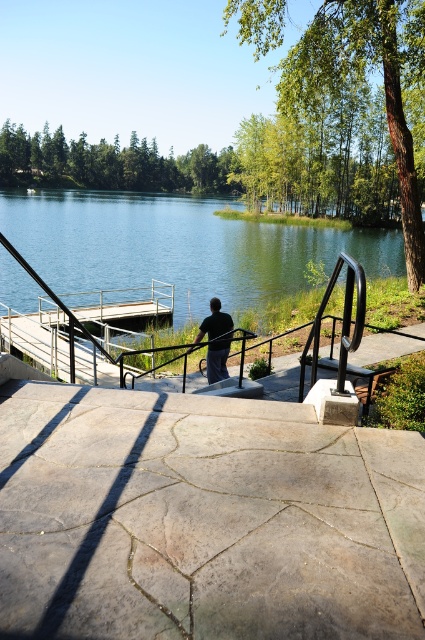
You are standing on the stone staircase and want to take a photo of the dark gray fabric pants at center and the green water at center. Which object should you focus on first if you want to include both in your photo without moving the camera?

The green water at center is positioned on the left side of dark gray fabric pants at center, so you should focus on the dark gray fabric pants at center first to ensure both are in frame.

You are standing at the top of the stone staircase and want to walk down to the dock. The green water at center is 12.30 meters from the camera. Can you safely walk down the stone steps to reach the water without getting your feet wet?

The green water at center is 12.30 meters from the camera, so yes, you can safely walk down the stone steps to reach the water without getting your feet wet since the distance is sufficient to avoid the water.